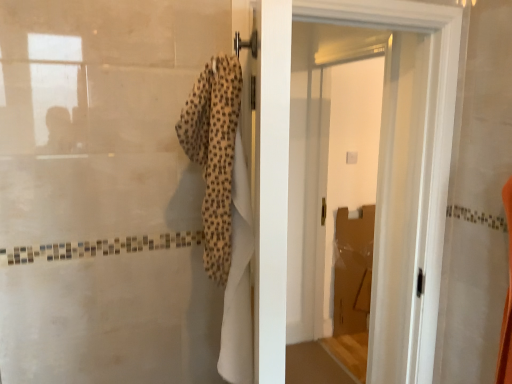
The height and width of the screenshot is (384, 512). In order to click on white glossy door at upper center in this screenshot , I will do `click(348, 151)`.

Locate an element on the screen. Image resolution: width=512 pixels, height=384 pixels. beige textured towel at center is located at coordinates (214, 153).

In order to click on white glossy door at upper center in this screenshot , I will do `click(348, 151)`.

Between white glossy door at center and beige textured towel at center, which one appears on the left side from the viewer's perspective?

From the viewer's perspective, beige textured towel at center appears more on the left side.

From a real-world perspective, is white glossy door at center physically below beige textured towel at center?

Yes, from a real-world perspective, white glossy door at center is below beige textured towel at center.

Choose the correct answer: Is white glossy door at center inside beige textured towel at center or outside it?

white glossy door at center is not enclosed by beige textured towel at center.

From the image's perspective, is white glossy door at center below beige textured towel at center?

Yes, from the image's perspective, white glossy door at center is beneath beige textured towel at center.

Looking at this image, is white glossy door at upper center next to white glossy door at center and touching it?

white glossy door at upper center and white glossy door at center are clearly separated.

In terms of width, does white glossy door at upper center look wider or thinner when compared to white glossy door at center?

white glossy door at upper center is wider than white glossy door at center.

Can you confirm if white glossy door at upper center is taller than white glossy door at center?

Yes.

Considering the relative positions of white glossy door at upper center and white glossy door at center in the image provided, is white glossy door at upper center to the right of white glossy door at center from the viewer's perspective?

Yes, white glossy door at upper center is to the right of white glossy door at center.

Which of these two, beige textured towel at center or white glossy door at upper center, stands taller?

Standing taller between the two is white glossy door at upper center.

Is beige textured towel at center directly adjacent to white glossy door at upper center?

beige textured towel at center is not next to white glossy door at upper center, and they're not touching.

From the image's perspective, is beige textured towel at center above or below white glossy door at upper center?

beige textured towel at center is situated higher than white glossy door at upper center in the image.

How much distance is there between beige textured towel at center and white glossy door at upper center?

A distance of 6.88 feet exists between beige textured towel at center and white glossy door at upper center.

This screenshot has height=384, width=512. Find the location of `bath towel that appears on the left of white glossy door at upper center`. bath towel that appears on the left of white glossy door at upper center is located at coordinates (214, 153).

Considering the sizes of white glossy door at upper center and beige textured towel at center in the image, is white glossy door at upper center wider or thinner than beige textured towel at center?

Considering their sizes, white glossy door at upper center looks broader than beige textured towel at center.

Is the depth of white glossy door at upper center less than that of beige textured towel at center?

No, the depth of white glossy door at upper center is greater than that of beige textured towel at center.

From a real-world perspective, is white glossy door at upper center below beige textured towel at center?

Yes, from a real-world perspective, white glossy door at upper center is under beige textured towel at center.

Does beige textured towel at center appear on the left side of white glossy door at center?

Indeed, beige textured towel at center is positioned on the left side of white glossy door at center.

From a real-world perspective, which is physically above, beige textured towel at center or white glossy door at center?

In real-world perspective, beige textured towel at center is above.

How far apart are beige textured towel at center and white glossy door at center?

beige textured towel at center is 16.32 inches from white glossy door at center.

Based on the photo, in terms of width, does beige textured towel at center look wider or thinner when compared to white glossy door at center?

beige textured towel at center is wider than white glossy door at center.

How far apart are white glossy door at center and white glossy door at upper center?

white glossy door at center and white glossy door at upper center are 4.45 feet apart from each other.

How different are the orientations of white glossy door at center and white glossy door at upper center in degrees?

91.5 degrees.

Which is more to the right, white glossy door at center or white glossy door at upper center?

white glossy door at upper center is more to the right.

The image size is (512, 384). Find the location of `door above the white glossy door at upper center (from the image's perspective)`. door above the white glossy door at upper center (from the image's perspective) is located at coordinates (287, 159).

You are a GUI agent. You are given a task and a screenshot of the screen. Output one action in this format:
    pyautogui.click(x=<x>, y=<y>)
    Task: Click on the bath towel on the left of white glossy door at center
    This screenshot has height=384, width=512.
    Given the screenshot: What is the action you would take?
    pyautogui.click(x=214, y=153)

At what (x,y) coordinates should I click in order to perform the action: click on screen door below the white glossy door at center (from a real-world perspective). Please return your answer as a coordinate pair (x, y). The height and width of the screenshot is (384, 512). Looking at the image, I should click on (348, 151).

Looking at the image, which one is located closer to white glossy door at upper center, white glossy door at center or beige textured towel at center?

The object closer to white glossy door at upper center is white glossy door at center.

Based on their spatial positions, is white glossy door at center or white glossy door at upper center further from beige textured towel at center?

white glossy door at upper center is positioned further to the anchor beige textured towel at center.

Which object lies nearer to the anchor point beige textured towel at center, white glossy door at upper center or white glossy door at center?

white glossy door at center is closer to beige textured towel at center.

Which object lies further to the anchor point white glossy door at center, beige textured towel at center or white glossy door at upper center?

white glossy door at upper center is positioned further to the anchor white glossy door at center.

From the image, which object appears to be nearer to white glossy door at upper center, beige textured towel at center or white glossy door at center?

white glossy door at center.

Estimate the real-world distances between objects in this image. Which object is closer to white glossy door at center, white glossy door at upper center or beige textured towel at center?

beige textured towel at center.

I want to click on door between beige textured towel at center and white glossy door at upper center along the z-axis, so click(287, 159).